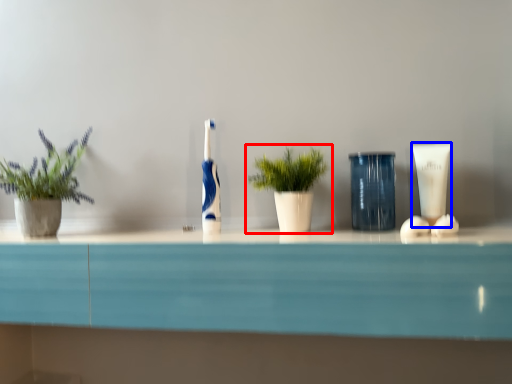
Question: Among these objects, which one is farthest to the camera, houseplant (highlighted by a red box) or toiletry (highlighted by a blue box)?

Choices:
 (A) houseplant
 (B) toiletry

Answer: (B)